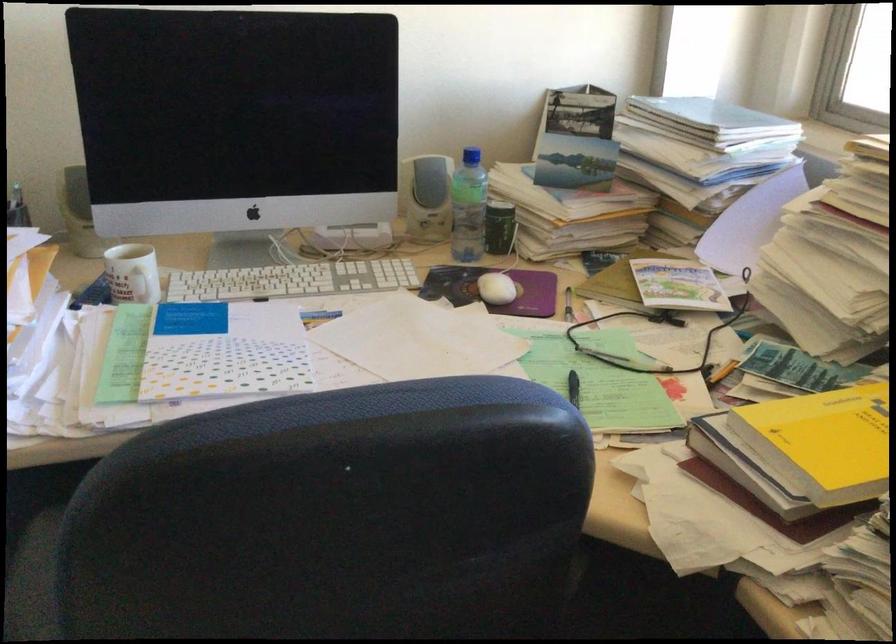
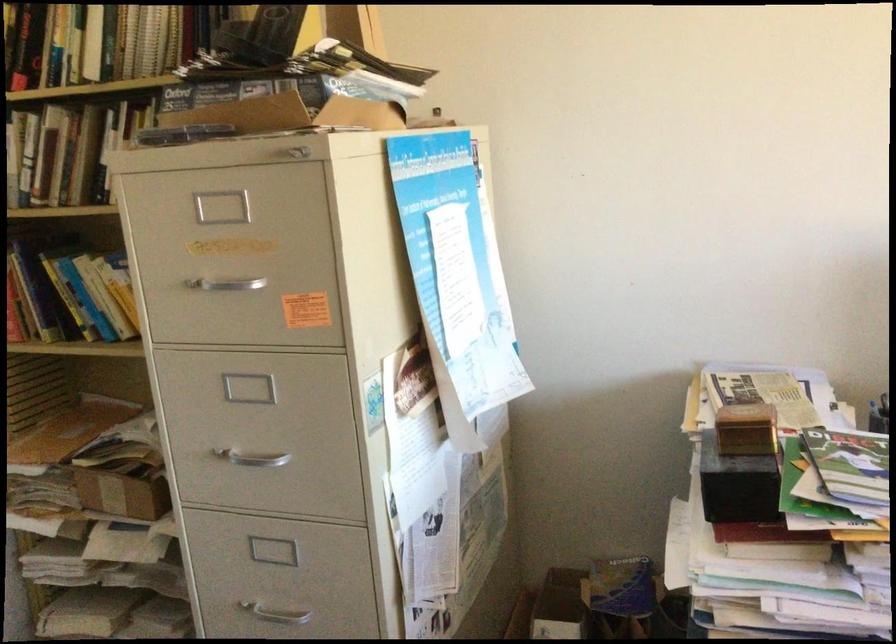
Question: The first image is from the beginning of the video and the second image is from the end. How did the camera likely rotate when shooting the video?

Choices:
 (A) Left
 (B) Right
 (C) Up
 (D) Down

Answer: (A)